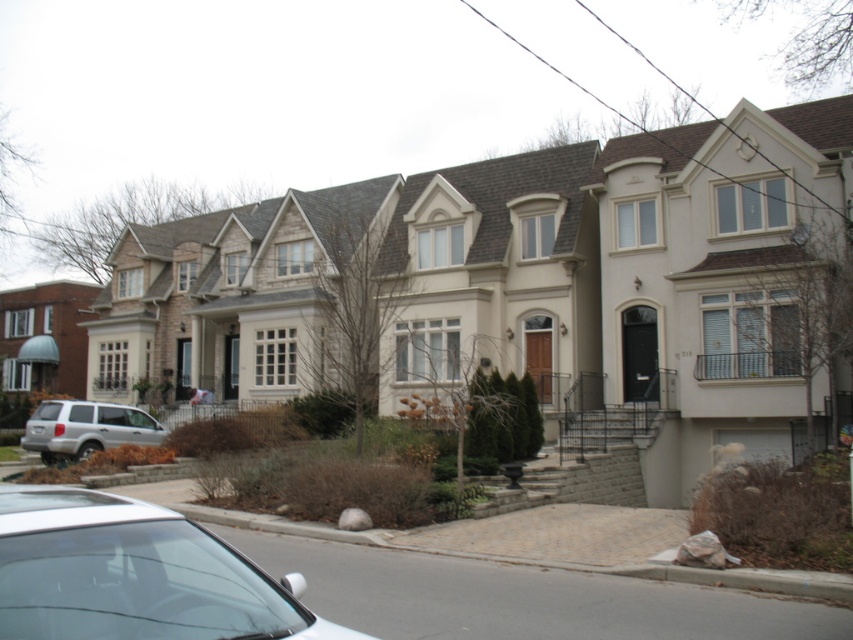
Question: Where is gray concrete curb at lower center located in relation to silver metallic suv at lower left in the image?

Choices:
 (A) left
 (B) right

Answer: (B)

Question: Is white glossy car at lower left to the right of gray concrete curb at lower center from the viewer's perspective?

Choices:
 (A) no
 (B) yes

Answer: (A)

Question: Which point is closer to the camera?

Choices:
 (A) gray concrete curb at lower center
 (B) white glossy car at lower left
 (C) silver metallic suv at lower left

Answer: (B)

Question: Can you confirm if white glossy car at lower left is positioned to the left of silver metallic suv at lower left?

Choices:
 (A) no
 (B) yes

Answer: (A)

Question: Which of the following is the farthest from the observer?

Choices:
 (A) gray concrete curb at lower center
 (B) silver metallic suv at lower left

Answer: (B)

Question: Among these points, which one is farthest from the camera?

Choices:
 (A) (61, 412)
 (B) (233, 556)
 (C) (712, 576)

Answer: (A)